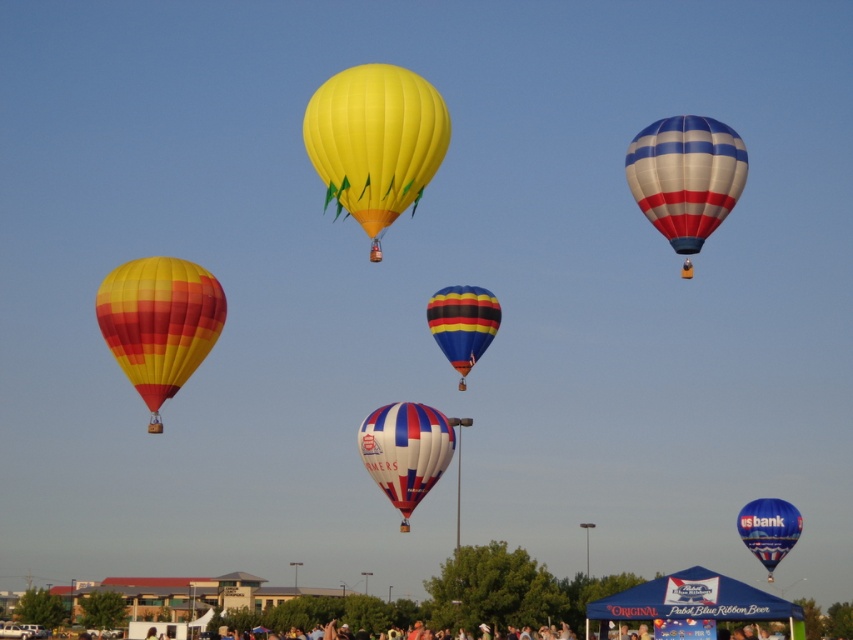
Question: Which point is farther from the camera taking this photo?

Choices:
 (A) (705, 212)
 (B) (785, 541)

Answer: (B)

Question: Is white and blue striped hot air balloon at upper right closer to camera compared to blue glossy hot air balloon at center?

Choices:
 (A) no
 (B) yes

Answer: (B)

Question: Which object is closer to the camera taking this photo?

Choices:
 (A) yellow fabric balloon at center
 (B) matte striped balloon at left
 (C) white and blue striped balloon at center

Answer: (A)

Question: Does yellow fabric balloon at center have a smaller size compared to matte striped balloon at left?

Choices:
 (A) no
 (B) yes

Answer: (A)

Question: Can you confirm if white and blue striped hot air balloon at upper right is thinner than white and blue striped balloon at center?

Choices:
 (A) no
 (B) yes

Answer: (B)

Question: Which point is farther to the camera?

Choices:
 (A) (726, 131)
 (B) (770, 522)

Answer: (B)